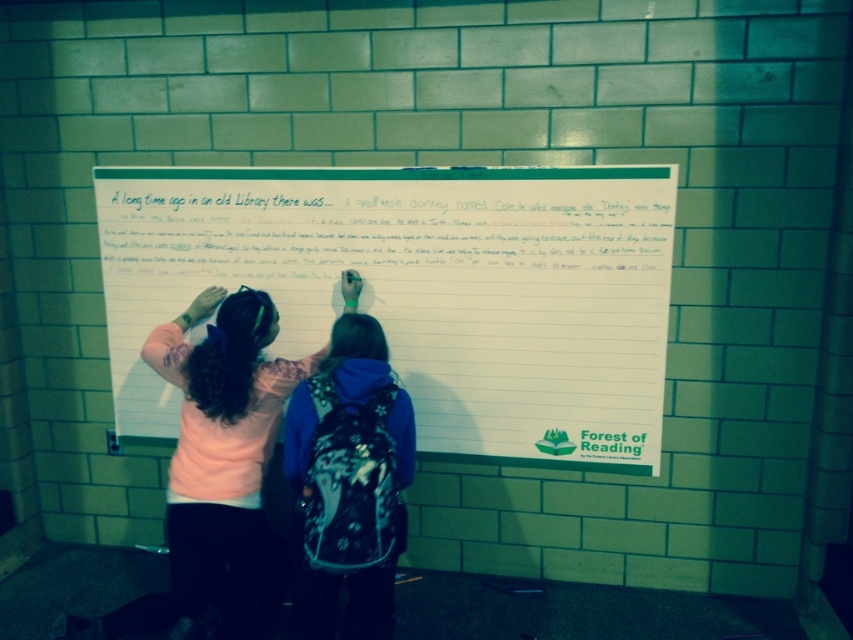
You are standing in front of the whiteboard and notice the white paper at center. Based on its position, can you determine if it is placed exactly in the middle of the whiteboard?

The white paper at center is located at point coordinates approximately 0.456 on the x and 0.495 on the y, which is very close to the center point of the whiteboard. Therefore, it is placed exactly in the middle of the whiteboard.